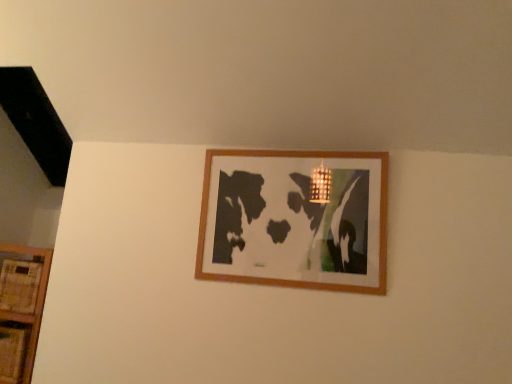
In order to face wooden picture frame at upper center, should I rotate leftwards or rightwards?

Rotate your view right by about 4.601°.

Measure the distance between point (x=295, y=267) and camera.

They are 5.35 feet apart.

What do you see at coordinates (294, 220) in the screenshot? I see `wooden picture frame at upper center` at bounding box center [294, 220].

The width and height of the screenshot is (512, 384). Identify the location of wooden picture frame at upper center. (294, 220).

Where is `wooden picture frame at upper center`? wooden picture frame at upper center is located at coordinates (294, 220).